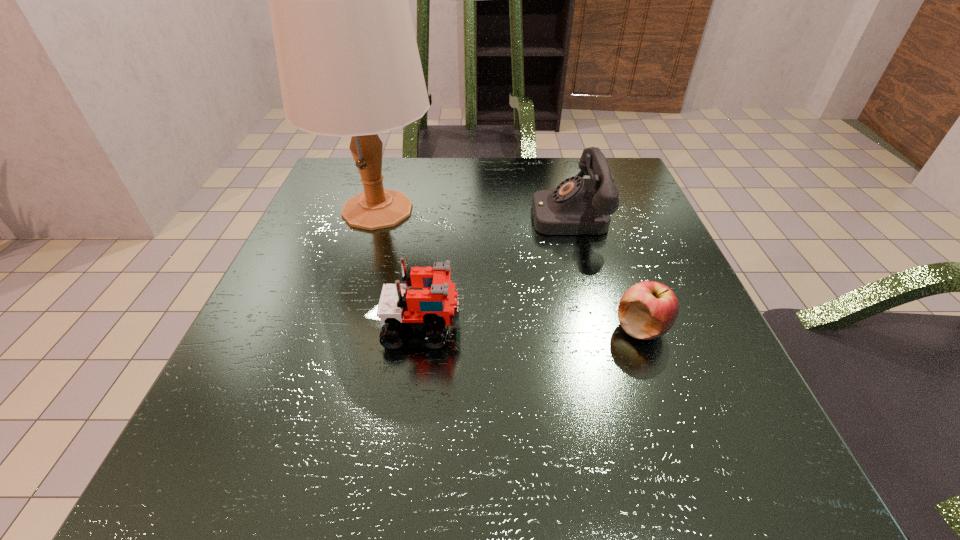
In the image, there is a desktop. At what (x,y) coordinates should I click in order to perform the action: click on free region at the right edge. Please return your answer as a coordinate pair (x, y). The width and height of the screenshot is (960, 540). Looking at the image, I should click on (695, 315).

This screenshot has height=540, width=960. I want to click on free space at the far left corner of the desktop, so click(x=356, y=182).

Identify the location of free region at the near left corner of the desktop. (156, 504).

Identify the location of free space between the table lamp and the shortest object. The height and width of the screenshot is (540, 960). (510, 269).

In order to click on vacant area between the apple and the tallest object in this screenshot , I will do `click(510, 269)`.

The width and height of the screenshot is (960, 540). What are the coordinates of `free space between the apple and the Lego` in the screenshot? It's located at (532, 327).

Where is `vacant area that lies between the tallest object and the Lego`? Image resolution: width=960 pixels, height=540 pixels. vacant area that lies between the tallest object and the Lego is located at coordinates (400, 268).

Where is `empty space between the telephone and the Lego`? empty space between the telephone and the Lego is located at coordinates (495, 270).

This screenshot has height=540, width=960. Identify the location of vacant space that is in between the tallest object and the apple. (510, 269).

The image size is (960, 540). What are the coordinates of `unoccupied position between the shortest object and the Lego` in the screenshot? It's located at (532, 327).